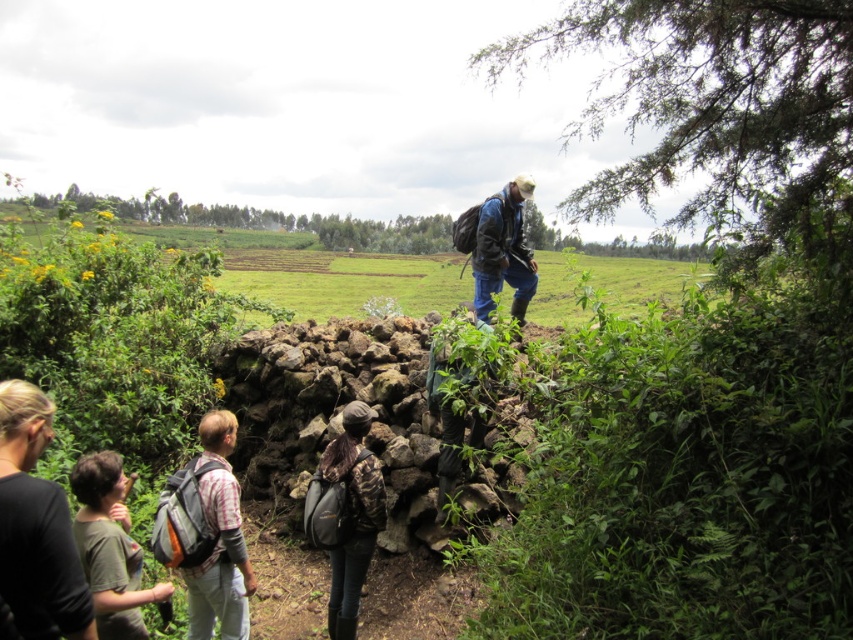
You are a photographer trying to capture a group photo of the people near the stone structure. You want to ensure both the black fabric shirt at lower left and the blue fabric jacket at center are clearly visible in the frame. Which clothing item should you focus on first to ensure it doesn t get cropped out?

The black fabric shirt at lower left is smaller than the blue fabric jacket at center, so you should focus on ensuring the smaller black fabric shirt at lower left is fully in frame first to prevent it from being accidentally cropped out.